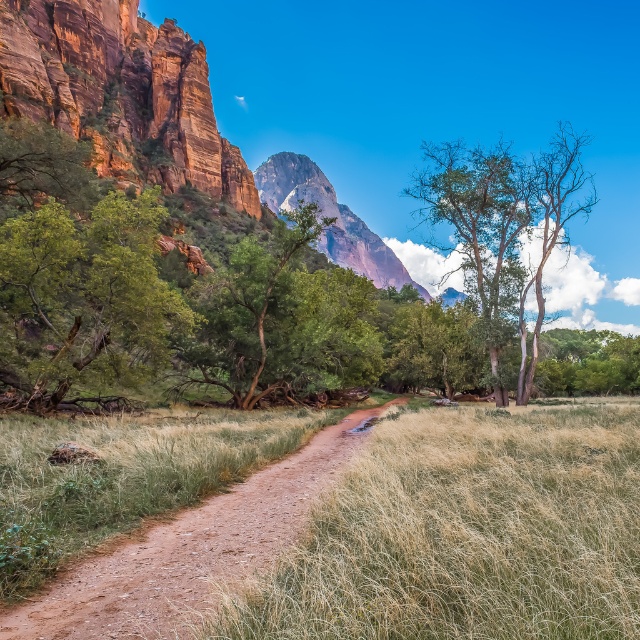
You are a hiker trying to navigate through the meadow. You see the dirt path at center and the green matte tree at center. Which direction should you head to reach the path from the tree?

The dirt path at center is positioned on the right side of the green matte tree at center, so to reach the path from the tree, you should head to the right.

You are standing at the point marked as point (188, 552) in the image. Based on the scene description, what is the most likely terrain you are currently on?

The point (188, 552) indicates dirt path at center, so you are most likely standing on the dirt path at center.

You are a hiker standing at the start of the dirt path at center. You see the green matte tree at center in the distance. Which one is taller?

The green matte tree at center is taller than the dirt path at center.